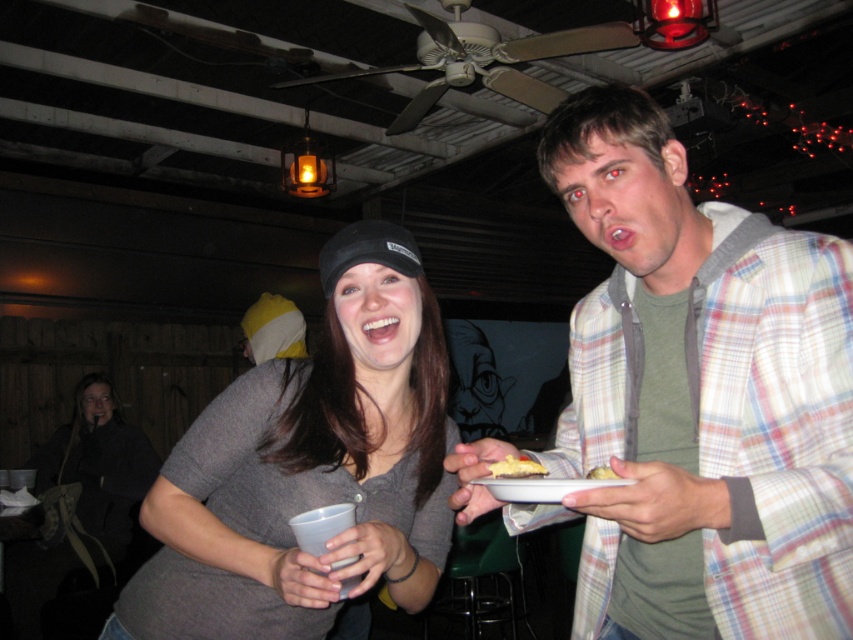
You are at a party and want to get a drink from the bar. There are two people blocking your path. The plaid shirt at upper right and the matte gray shirt at center. Which person is closer to you?

The plaid shirt at upper right is positioned over matte gray shirt at center, so the plaid shirt at upper right is closer to you.

In the scene shown: You are at a party and want to grab a slice of the yellow cake at center. There is a person wearing a matte gray shirt at center in your way. Which direction should you move to reach the cake without bumping into them?

Since the matte gray shirt at center is to the left of the yellow cake at center, you should move to the right to avoid the person and reach the cake.